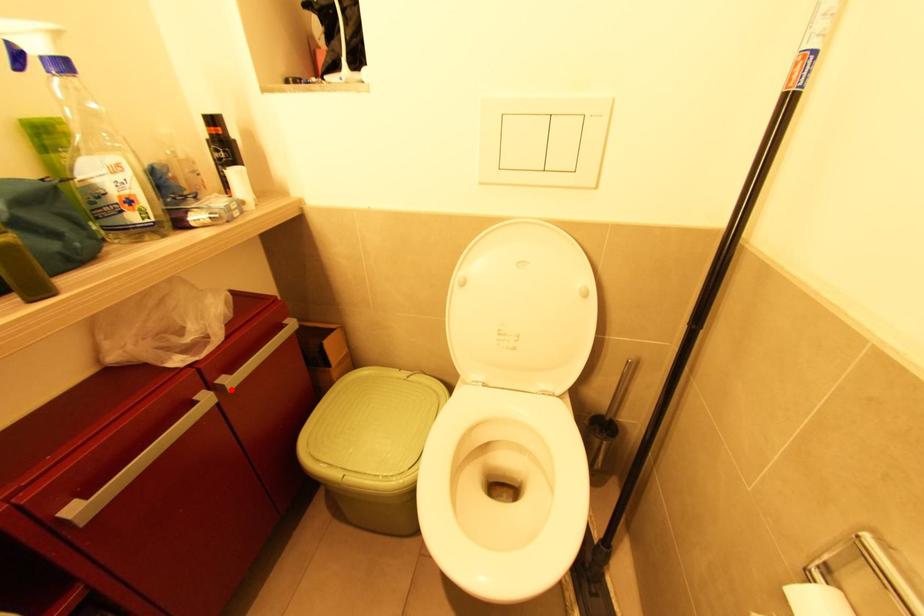
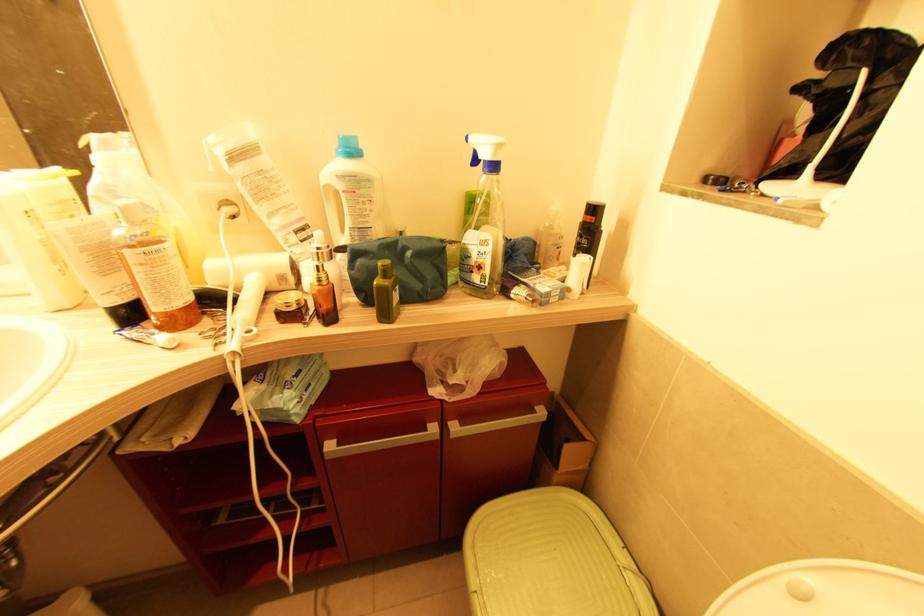
Where in the second image is the point corresponding to the highlighted location from the first image?

(454, 438)